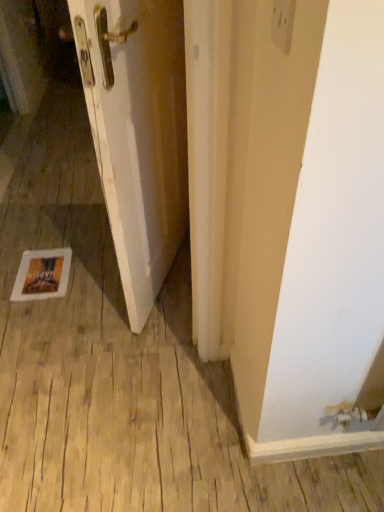
Where is `white matte door at left`? This screenshot has width=384, height=512. white matte door at left is located at coordinates (137, 133).

The image size is (384, 512). Describe the element at coordinates (137, 133) in the screenshot. I see `white matte door at left` at that location.

You are a GUI agent. You are given a task and a screenshot of the screen. Output one action in this format:
    pyautogui.click(x=<x>, y=<y>)
    Task: Click on the white matte door at left
    
    Given the screenshot: What is the action you would take?
    pyautogui.click(x=137, y=133)